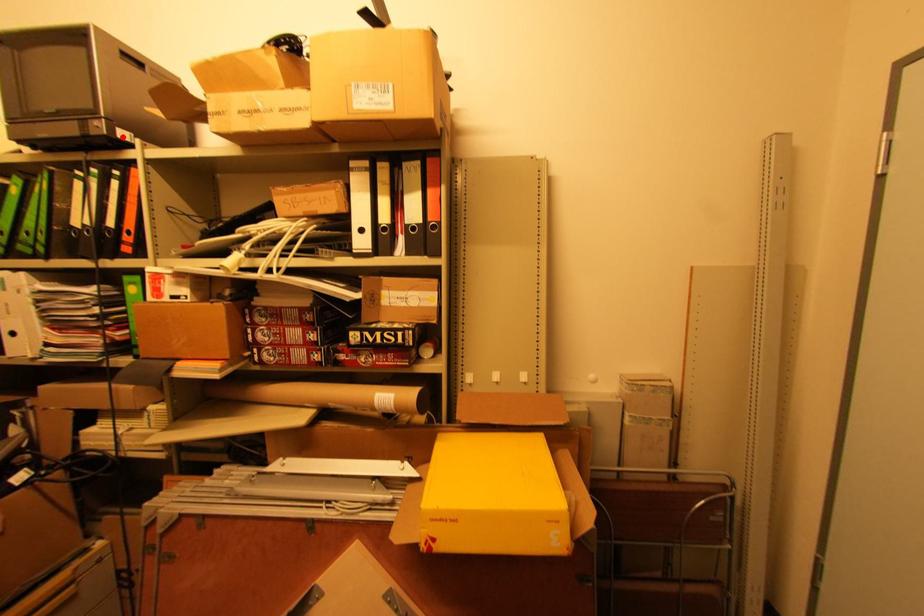
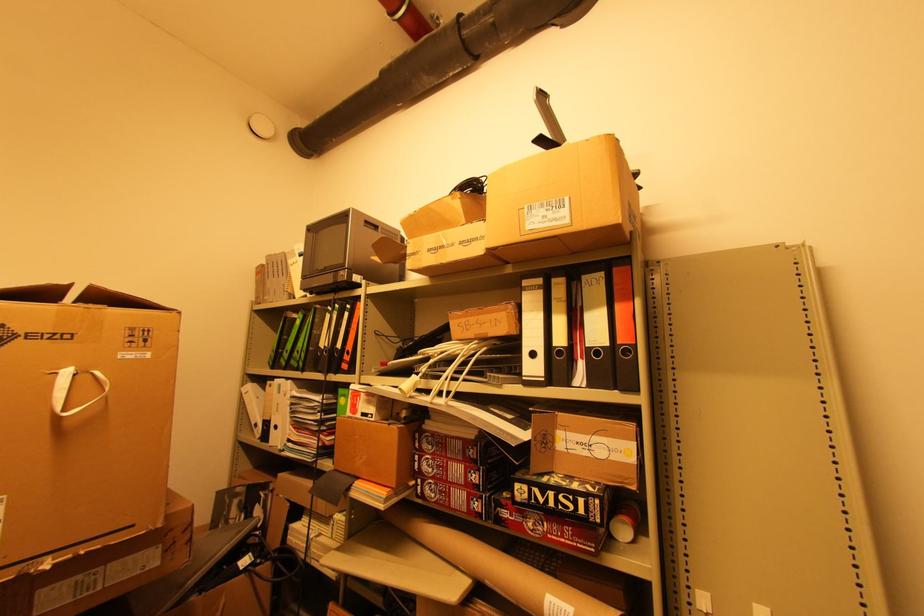
Where in the second image is the point corresponding to the highlighted location from the first image?

(358, 281)